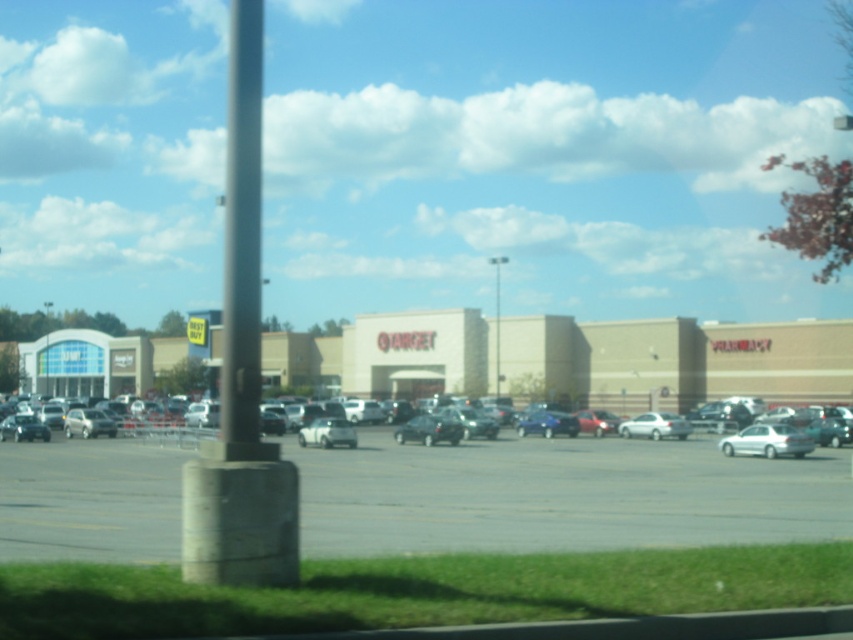
Question: Does beige brick mall at center have a smaller size compared to metallic gray pole at left?

Choices:
 (A) yes
 (B) no

Answer: (B)

Question: Which point is farther to the camera?

Choices:
 (A) (339, 508)
 (B) (525, 426)
 (C) (22, 435)
 (D) (680, 420)

Answer: (B)

Question: Considering the real-world distances, which object is closest to the white matte sedan at center?

Choices:
 (A) satin silver sedan at center
 (B) shiny blue sedan at center

Answer: (B)

Question: Which object is positioned closest to the white matte sedan at center?

Choices:
 (A) beige brick mall at center
 (B) metallic gray pole at left
 (C) satin silver sedan at center
 (D) shiny blue sedan at center

Answer: (D)

Question: Does smooth gray pole at left come in front of matte silver sedan at center?

Choices:
 (A) no
 (B) yes

Answer: (B)

Question: Is silver metallic sedan at lower center bigger than shiny silver sedan at left?

Choices:
 (A) no
 (B) yes

Answer: (B)